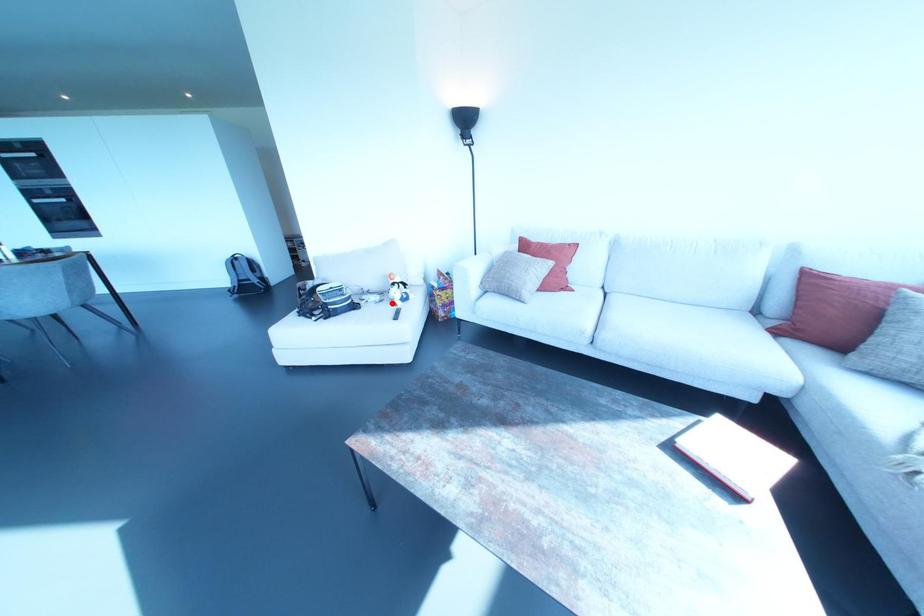
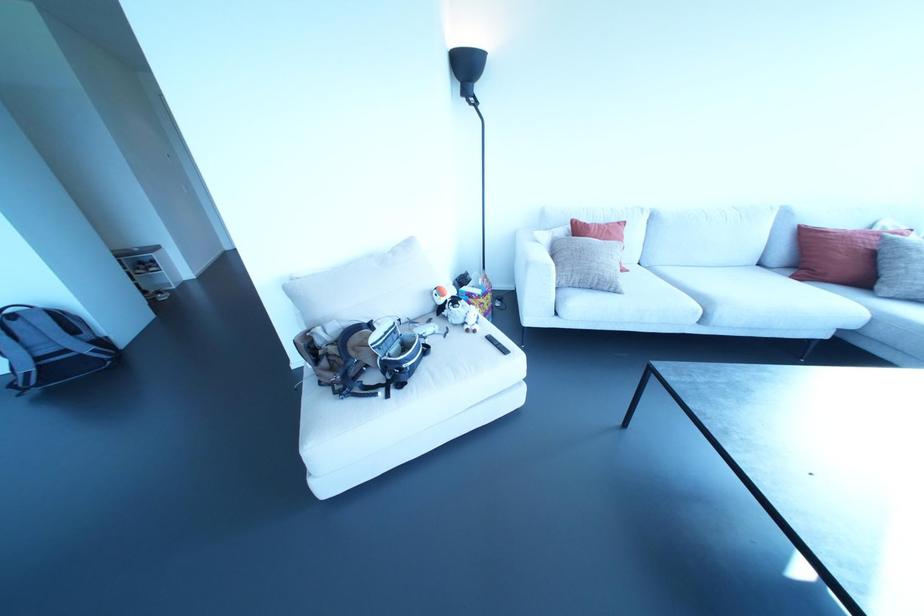
Where in the second image is the point corresponding to the highlighted location from the first image?

(467, 330)